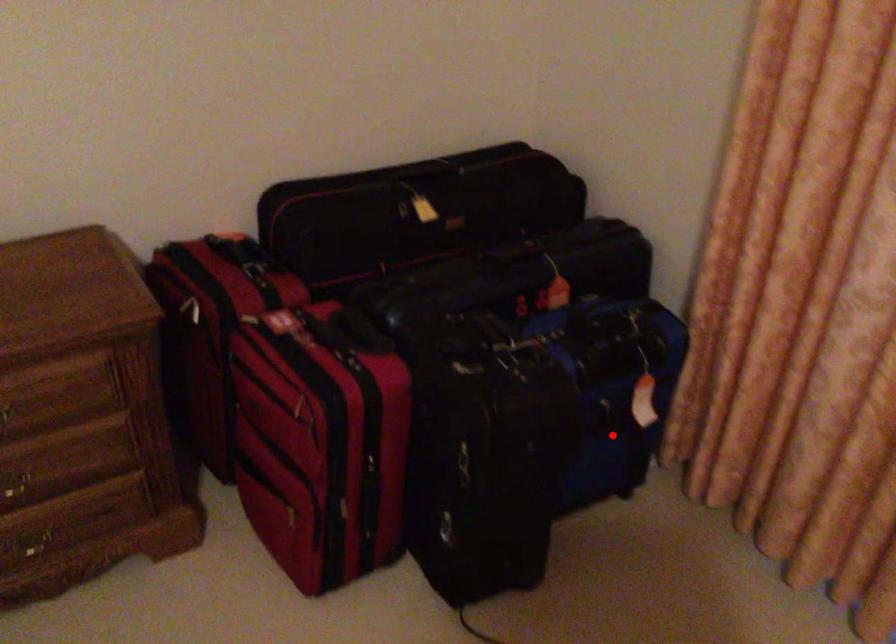
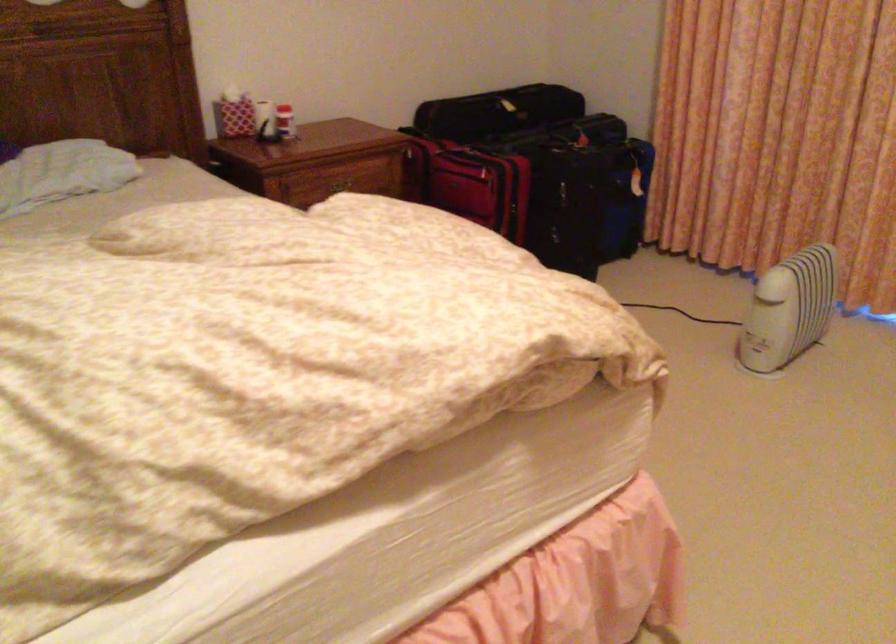
Find the pixel in the second image that matches the highlighted location in the first image.

(625, 199)